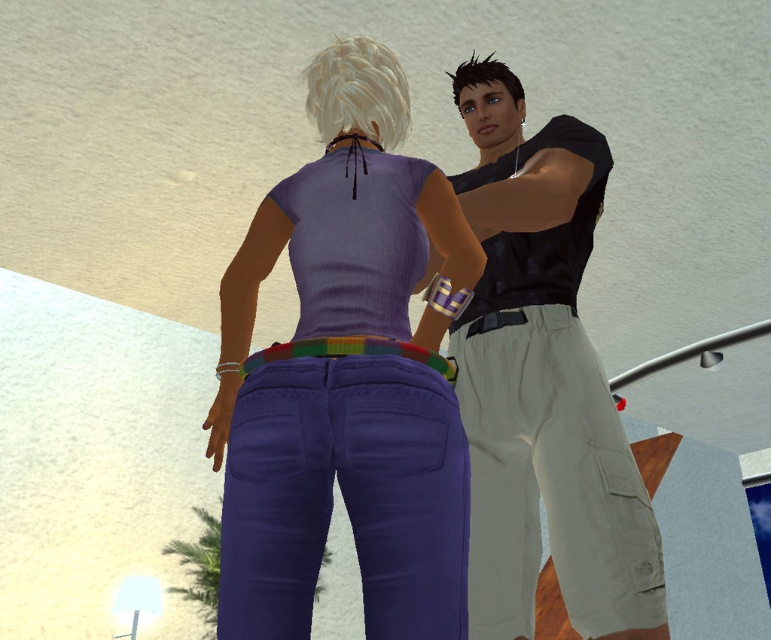
You are a character in the scene and want to move from point [367,355] to point [541,220]. Which direction should you move relative to your current position?

Since point [367,355] is closer to the camera than point [541,220], you should move backward to reach the farther point [541,220].

From the picture: You are a photographer trying to capture a closeup shot of the purple matte jeans at center and the multicolored woven belt at center. Since you want the jeans to be in focus, which object should you adjust your camera focus on first?

The purple matte jeans at center is closer to the viewer than the multicolored woven belt at center, so you should focus on the purple matte jeans at center first to ensure it is in focus.

You are designing a costume for a character and need to ensure that the purple matte jeans at center and the multicolored woven belt at center fit together properly. Based on the scene description, which of the two items is wider?

The purple matte jeans at center might be wider than multicolored woven belt at center according to the description.